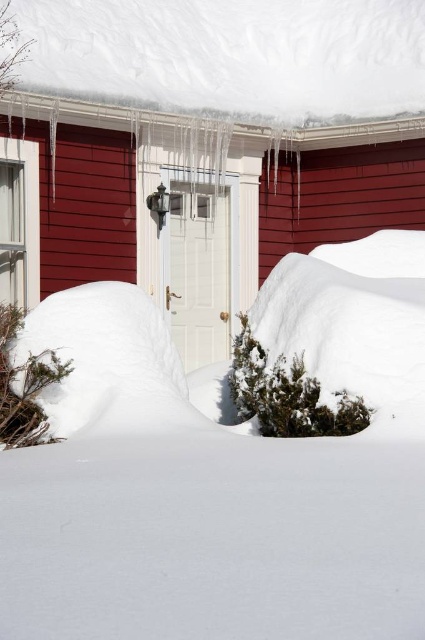
You are standing in front of the snowy house and want to determine the relative positions of two points marked on the image. Which point, point 1 at coordinates (269, 314) or point 2 at coordinates (241, 51), is closer to you?

Point 1 at coordinates (269, 314) is closer to the viewer than point 2 at coordinates (241, 51).